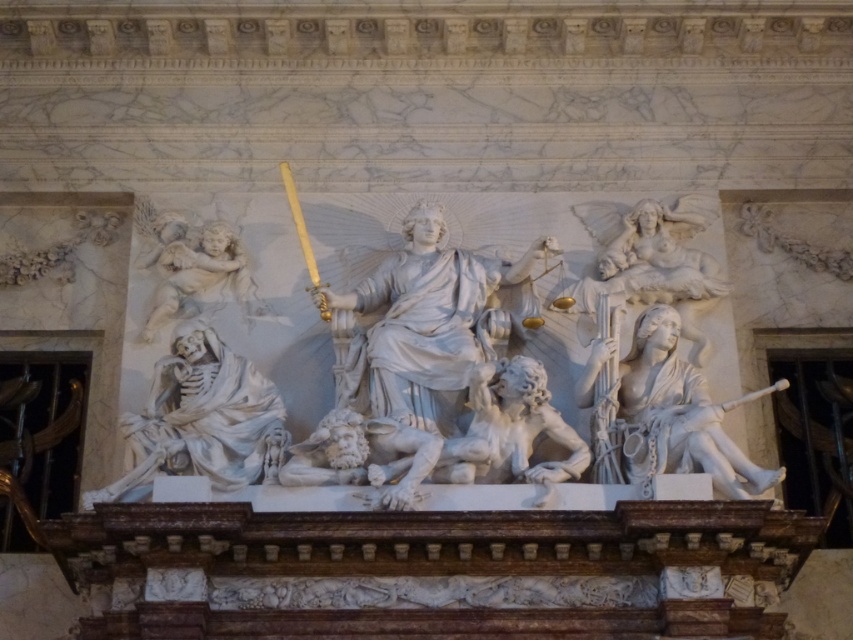
You are an architect examining the sculpture and need to locate the white marble woman at right. According to the coordinates provided, where would you find her position relative to the central figure?

The white marble woman at right is located at point 0.648 along the horizontal axis and 0.796 along the vertical axis, meaning she is positioned to the right and slightly above the central figure.

Looking at the white marble woman at right and the white marble cherub at upper left in the sculpture, which one is wider?

The white marble woman at right is wider than the white marble cherub at upper left.

You are an art historian examining this relief sculpture. You notice the white marble woman at right and the white marble angel at upper right. Which of these two figures is positioned closer to the observer?

The white marble woman at right is closer to the viewer than the white marble angel at upper right according to the description.